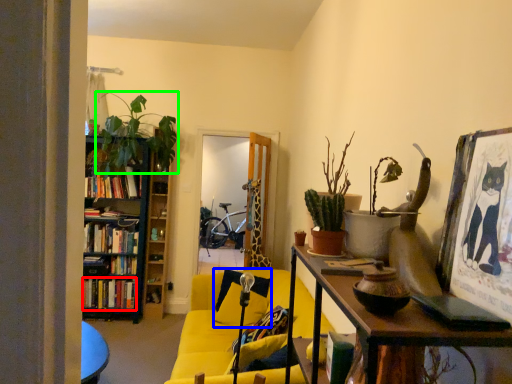
Question: Estimate the real-world distances between objects in this image. Which object is closer to book (highlighted by a red box), pillow (highlighted by a blue box) or houseplant (highlighted by a green box)?

Choices:
 (A) pillow
 (B) houseplant

Answer: (B)